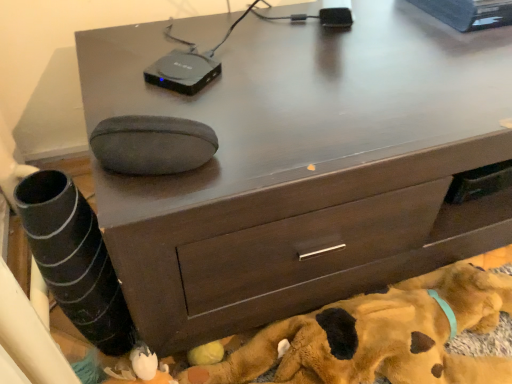
Question: From the image's perspective, does black plastic device at upper center appear lower than brown plush dog at lower center?

Choices:
 (A) yes
 (B) no

Answer: (B)

Question: Considering the relative sizes of black plastic device at upper center and brown plush dog at lower center in the image provided, is black plastic device at upper center thinner than brown plush dog at lower center?

Choices:
 (A) yes
 (B) no

Answer: (A)

Question: Is black plastic device at upper center at the left side of brown plush dog at lower center?

Choices:
 (A) yes
 (B) no

Answer: (A)

Question: Can you confirm if black plastic device at upper center is positioned to the right of brown plush dog at lower center?

Choices:
 (A) yes
 (B) no

Answer: (B)

Question: Are black plastic device at upper center and brown plush dog at lower center beside each other?

Choices:
 (A) yes
 (B) no

Answer: (B)

Question: Can you confirm if black plastic device at upper center is smaller than brown plush dog at lower center?

Choices:
 (A) no
 (B) yes

Answer: (B)

Question: From a real-world perspective, is brown plush dog at lower center physically below black plastic device at upper center?

Choices:
 (A) yes
 (B) no

Answer: (A)

Question: Does brown plush dog at lower center have a larger size compared to black plastic device at upper center?

Choices:
 (A) yes
 (B) no

Answer: (A)

Question: Is black plastic device at upper center inside brown plush dog at lower center?

Choices:
 (A) no
 (B) yes

Answer: (A)

Question: From a real-world perspective, is brown plush dog at lower center located higher than black plastic device at upper center?

Choices:
 (A) no
 (B) yes

Answer: (A)

Question: Is the depth of brown plush dog at lower center less than that of black plastic device at upper center?

Choices:
 (A) no
 (B) yes

Answer: (B)

Question: Is brown plush dog at lower center wider than black plastic device at upper center?

Choices:
 (A) no
 (B) yes

Answer: (B)

Question: In terms of width, does black plastic device at upper center look wider or thinner when compared to brown plush dog at lower center?

Choices:
 (A) thin
 (B) wide

Answer: (A)